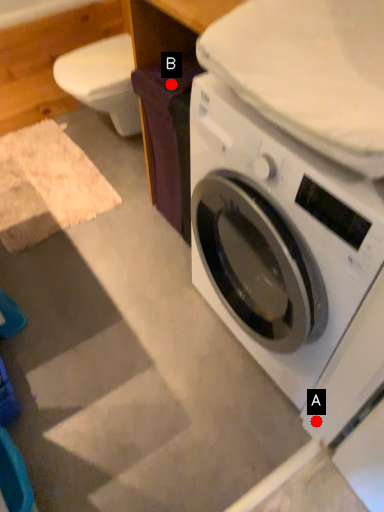
Question: Two points are circled on the image, labeled by A and B beside each circle. Which point is farther from the camera taking this photo?

Choices:
 (A) A is further
 (B) B is further

Answer: (B)